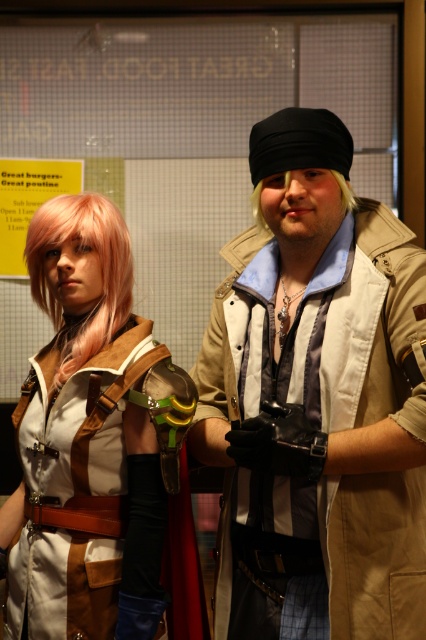
How distant is matte beige jacket at center from blonde hair wig at center?

A distance of 12.85 inches exists between matte beige jacket at center and blonde hair wig at center.

Is point (206, 384) positioned behind point (255, 216)?

Yes, point (206, 384) is behind point (255, 216).

Is point (322, 362) more distant than point (351, 209)?

No, (322, 362) is in front of (351, 209).

Where is `matte beige jacket at center`? matte beige jacket at center is located at coordinates pyautogui.click(x=316, y=401).

Does matte beige jacket at center appear over pink synthetic wig at left?

No, matte beige jacket at center is not above pink synthetic wig at left.

Can you confirm if matte beige jacket at center is positioned to the left of pink synthetic wig at left?

In fact, matte beige jacket at center is to the right of pink synthetic wig at left.

The width and height of the screenshot is (426, 640). What are the coordinates of `matte beige jacket at center` in the screenshot? It's located at (316, 401).

Which is behind, point (42, 243) or point (258, 224)?

The point (258, 224) is more distant.

Who is more distant from viewer, (121, 531) or (337, 172)?

Point (121, 531)

Locate an element on the screen. matte brown vest at center is located at coordinates (92, 438).